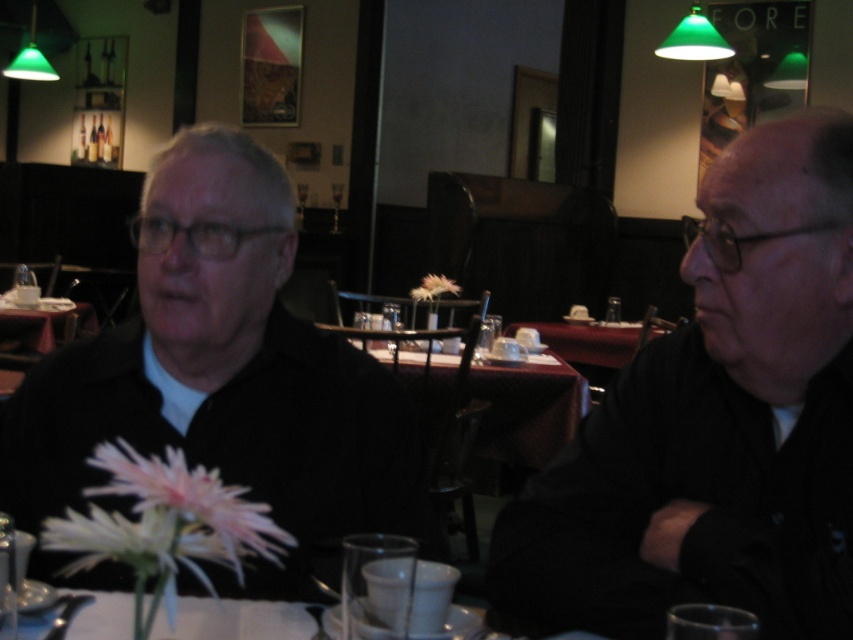
Question: Considering the relative positions of black matte jacket at left and maroon fabric table at center in the image provided, where is black matte jacket at left located with respect to maroon fabric table at center?

Choices:
 (A) below
 (B) above

Answer: (B)

Question: Is black matte jacket at right to the right of wooden table at center from the viewer's perspective?

Choices:
 (A) yes
 (B) no

Answer: (A)

Question: Estimate the real-world distances between objects in this image. Which object is closer to the black matte jacket at left?

Choices:
 (A) maroon fabric table at center
 (B) wooden table at center
 (C) black matte jacket at right

Answer: (C)

Question: Which point is farther to the camera?

Choices:
 (A) (451, 364)
 (B) (381, 419)
 (C) (845, 289)
 (D) (45, 304)

Answer: (D)

Question: Based on their relative distances, which object is nearer to the maroon fabric table at center?

Choices:
 (A) wooden table at center
 (B) black matte jacket at left
 (C) black matte jacket at right

Answer: (B)

Question: Can you confirm if maroon fabric table at center is thinner than wooden table at center?

Choices:
 (A) yes
 (B) no

Answer: (B)